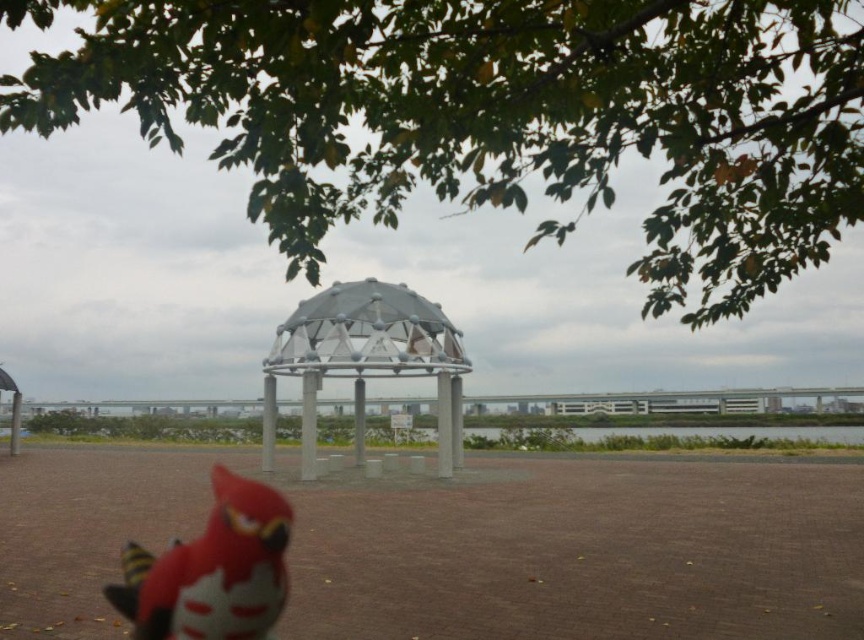
Question: Is green leafy tree at upper center further to camera compared to red matte parrot at lower left?

Choices:
 (A) yes
 (B) no

Answer: (B)

Question: Which of the following is the closest to the observer?

Choices:
 (A) (268, 520)
 (B) (722, 38)
 (C) (367, 280)

Answer: (B)

Question: From the image, what is the correct spatial relationship of green leafy tree at upper center in relation to metallic dome at center?

Choices:
 (A) left
 (B) right

Answer: (B)

Question: In this image, where is green leafy tree at upper center located relative to red matte parrot at lower left?

Choices:
 (A) below
 (B) above

Answer: (B)

Question: Among these points, which one is farthest from the camera?

Choices:
 (A) (286, 534)
 (B) (367, 284)
 (C) (722, 44)

Answer: (B)

Question: Which point appears farthest from the camera in this image?

Choices:
 (A) (265, 609)
 (B) (295, 326)

Answer: (B)